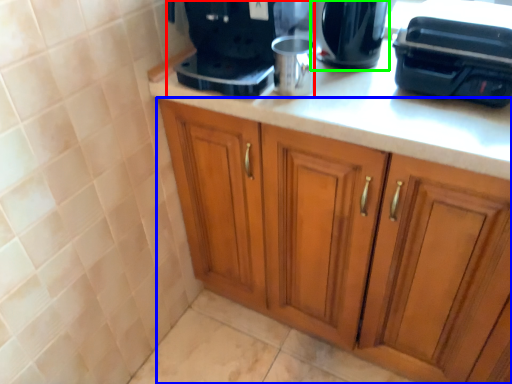
Question: Which is nearer to the home appliance (highlighted by a red box)? cabinetry (highlighted by a blue box) or kitchen appliance (highlighted by a green box).

Choices:
 (A) cabinetry
 (B) kitchen appliance

Answer: (B)